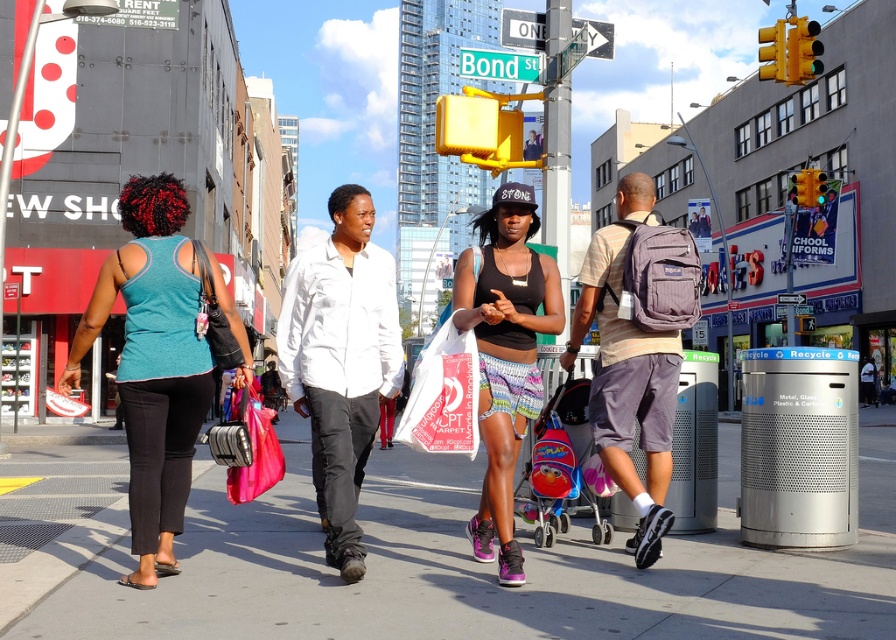
I want to click on gray concrete sidewalk at center, so click(x=481, y=566).

How much distance is there between gray concrete sidewalk at center and matte purple backpack at center right?

gray concrete sidewalk at center is 2.59 meters from matte purple backpack at center right.

What do you see at coordinates (481, 566) in the screenshot? The image size is (896, 640). I see `gray concrete sidewalk at center` at bounding box center [481, 566].

Locate an element on the screen. This screenshot has height=640, width=896. gray concrete sidewalk at center is located at coordinates pos(481,566).

Does teal fabric tank top at center come in front of white matte shirt at center?

Yes, it is.

Does teal fabric tank top at center have a smaller size compared to white matte shirt at center?

No.

Who is more distant from viewer, (156, 413) or (352, 268)?

The point (352, 268) is more distant.

This screenshot has height=640, width=896. What are the coordinates of `teal fabric tank top at center` in the screenshot? It's located at (158, 358).

Is teal fabric tank top at center below matte purple backpack at center right?

Yes, teal fabric tank top at center is below matte purple backpack at center right.

Locate an element on the screen. The image size is (896, 640). teal fabric tank top at center is located at coordinates (158, 358).